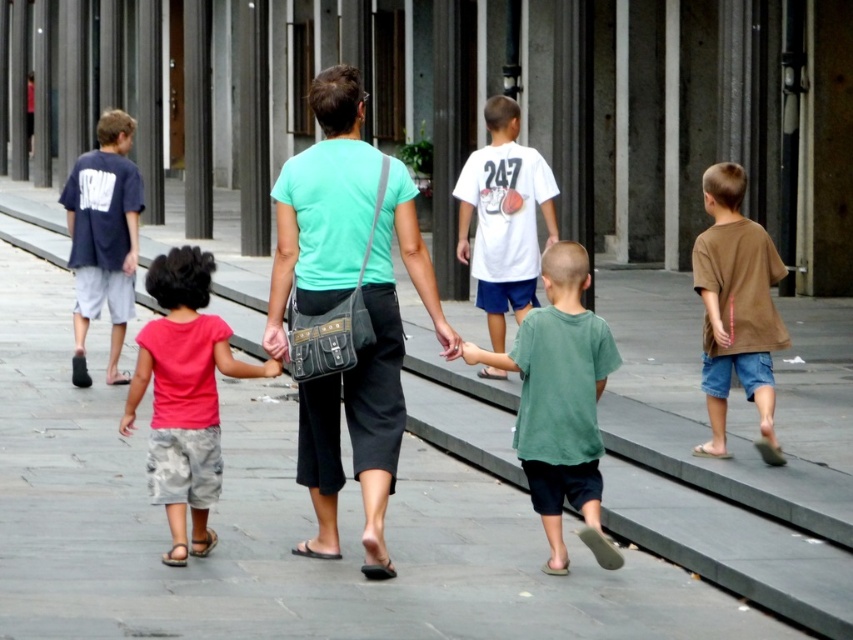
You are a photographer trying to capture a group photo of the matte green shirt at center and the brown cotton shirt at right. If your camera has a maximum focus range of 8 feet, will you be able to capture both subjects in focus at the same time?

The distance between the matte green shirt at center and the brown cotton shirt at right is 7.68 feet, which is within the camera maximum focus range of 8 feet. Therefore, you can capture both subjects in focus at the same time.

You are a photographer trying to capture a clear shot of the matte green shirt at center and the green cotton shirt at center. Since both are in the same area, which one is closer to the camera?

The matte green shirt at center is in front of the green cotton shirt at center, so the matte green shirt at center is closer to the camera.